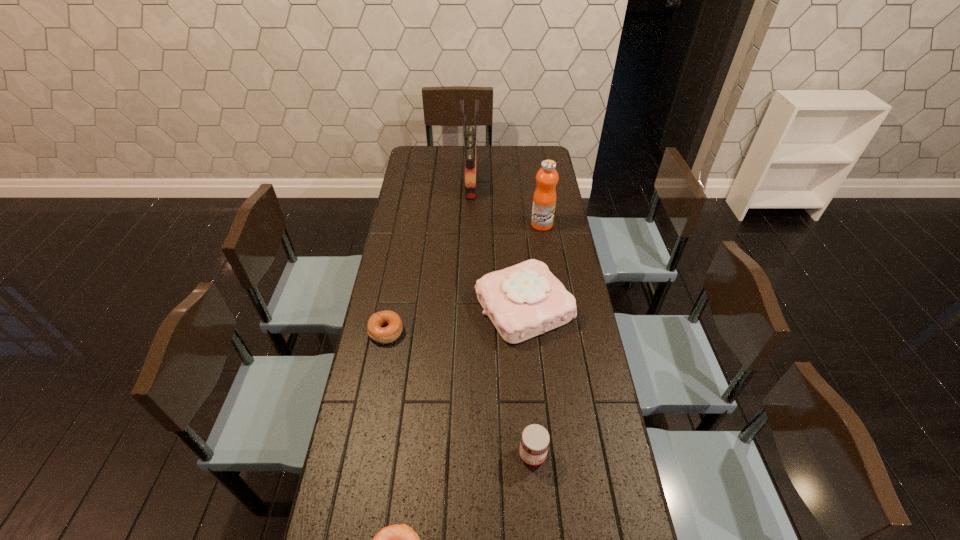
In order to click on vacant area at the right edge of the desktop in this screenshot , I will do `click(588, 392)`.

Where is `free space at the far left corner of the desktop`? Image resolution: width=960 pixels, height=540 pixels. free space at the far left corner of the desktop is located at coordinates (410, 156).

Where is `free space between the taller bagel and the cake`? free space between the taller bagel and the cake is located at coordinates (455, 320).

You are a GUI agent. You are given a task and a screenshot of the screen. Output one action in this format:
    pyautogui.click(x=<x>, y=<y>)
    Task: Click on the vacant area that lies between the taller bagel and the fruit juice
    This screenshot has height=540, width=960.
    Given the screenshot: What is the action you would take?
    pyautogui.click(x=464, y=278)

Locate an element on the screen. Image resolution: width=960 pixels, height=540 pixels. free space between the taller bagel and the fifth farthest object is located at coordinates (459, 393).

Where is `vacant area that lies between the tallest object and the cake`? This screenshot has height=540, width=960. vacant area that lies between the tallest object and the cake is located at coordinates (497, 245).

Identify the location of free spot between the cake and the second shortest object. Image resolution: width=960 pixels, height=540 pixels. (455, 320).

Identify which object is located as the third nearest to the third shortest object. Please provide its 2D coordinates. Your answer should be formatted as a tuple, i.e. [(x, y)], where the tuple contains the x and y coordinates of a point satisfying the conditions above.

[(392, 321)]

Locate which object is the third closest to the farthest object. Please provide its 2D coordinates. Your answer should be formatted as a tuple, i.e. [(x, y)], where the tuple contains the x and y coordinates of a point satisfying the conditions above.

[(392, 321)]

The image size is (960, 540). Find the location of `free location that satisfies the following two spatial constraints: 1. on the front-facing side of the cake; 2. on the right side of the shopping bag`. free location that satisfies the following two spatial constraints: 1. on the front-facing side of the cake; 2. on the right side of the shopping bag is located at coordinates (468, 307).